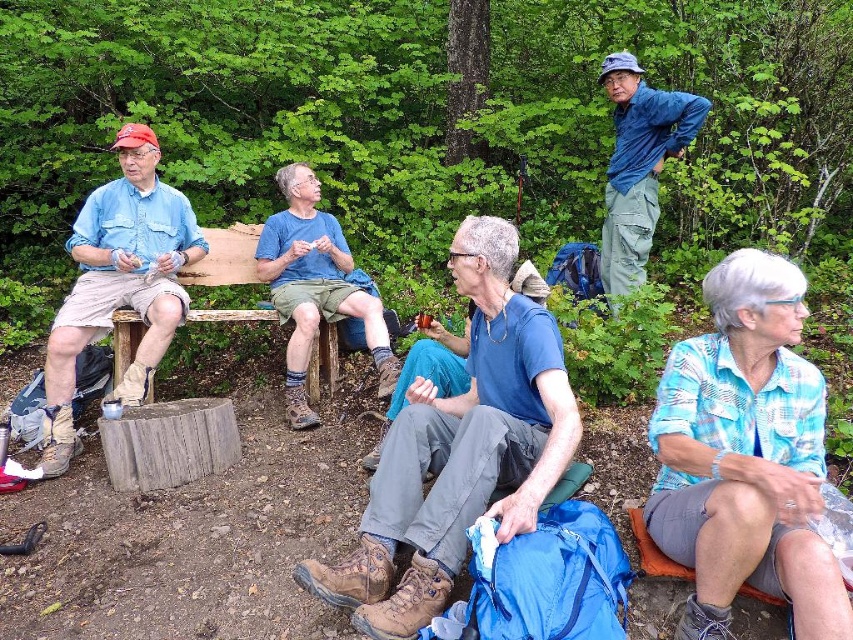
Is point (712, 541) closer to viewer compared to point (425, 525)?

Yes, point (712, 541) is closer to viewer.

Can you confirm if blue plaid shirt at lower right is shorter than blue fabric backpack at center?

Yes.

Locate an element on the screen. Image resolution: width=853 pixels, height=640 pixels. blue plaid shirt at lower right is located at coordinates (746, 456).

Does point (698, 433) come behind point (128, 225)?

That is False.

Does point (753, 388) come in front of point (161, 252)?

Yes.

I want to click on blue plaid shirt at lower right, so click(x=746, y=456).

Between blue plaid shirt at lower right and blue cotton shirt at center, which one has more height?

Standing taller between the two is blue cotton shirt at center.

Between point (672, 352) and point (305, 369), which one is positioned in front?

Point (672, 352) is in front.

At what (x,y) coordinates should I click in order to perform the action: click on blue plaid shirt at lower right. Please return your answer as a coordinate pair (x, y). Image resolution: width=853 pixels, height=640 pixels. Looking at the image, I should click on (746, 456).